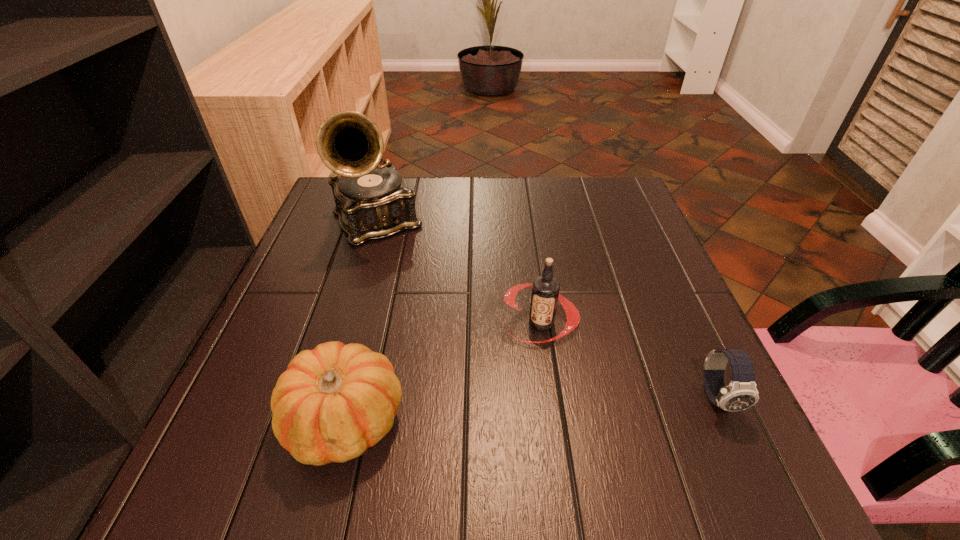
Find the location of a particular element. This screenshot has width=960, height=540. gourd is located at coordinates (334, 402).

In order to click on the rightmost object in this screenshot , I will do `click(741, 393)`.

You are a GUI agent. You are given a task and a screenshot of the screen. Output one action in this format:
    pyautogui.click(x=<x>, y=<y>)
    Task: Click on the second object from right to left
    This screenshot has height=540, width=960.
    Given the screenshot: What is the action you would take?
    pyautogui.click(x=545, y=294)

Where is `the third nearest object`? Image resolution: width=960 pixels, height=540 pixels. the third nearest object is located at coordinates (545, 294).

Locate an element on the screen. the tallest object is located at coordinates (373, 202).

Where is `the farthest object`? This screenshot has height=540, width=960. the farthest object is located at coordinates click(373, 202).

Find the location of a particular element. This screenshot has width=960, height=540. vacant space positioned 0.370m on the right of the gourd is located at coordinates (623, 421).

Locate an element on the screen. Image resolution: width=960 pixels, height=540 pixels. vacant space situated on the label of the third shortest object is located at coordinates (492, 400).

The width and height of the screenshot is (960, 540). In order to click on vacant space located on the label of the third shortest object in this screenshot , I will do `click(482, 417)`.

This screenshot has height=540, width=960. What are the coordinates of `vacant space located on the label of the third shortest object` in the screenshot? It's located at (471, 437).